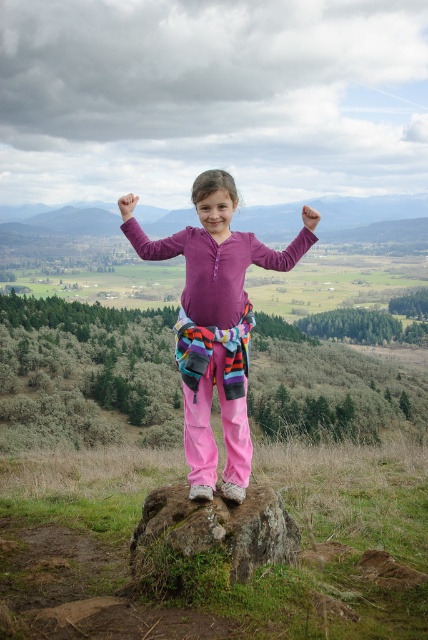
Looking at this image, does purple matte shirt at center have a lesser height compared to matte skin hand at center?

Correct, purple matte shirt at center is not as tall as matte skin hand at center.

Does point (181, 236) come closer to viewer compared to point (127, 196)?

Yes.

This screenshot has width=428, height=640. Find the location of `purple matte shirt at center`. purple matte shirt at center is located at coordinates (146, 236).

Is matte purple sweater at center positioned at the back of green mossy rock at center?

That is True.

Does point (228, 236) come closer to viewer compared to point (163, 486)?

Yes, it is in front of point (163, 486).

This screenshot has height=640, width=428. Find the location of `matte purple sweater at center`. matte purple sweater at center is located at coordinates (216, 326).

This screenshot has width=428, height=640. What are the coordinates of `green mossy rock at center` in the screenshot? It's located at (216, 529).